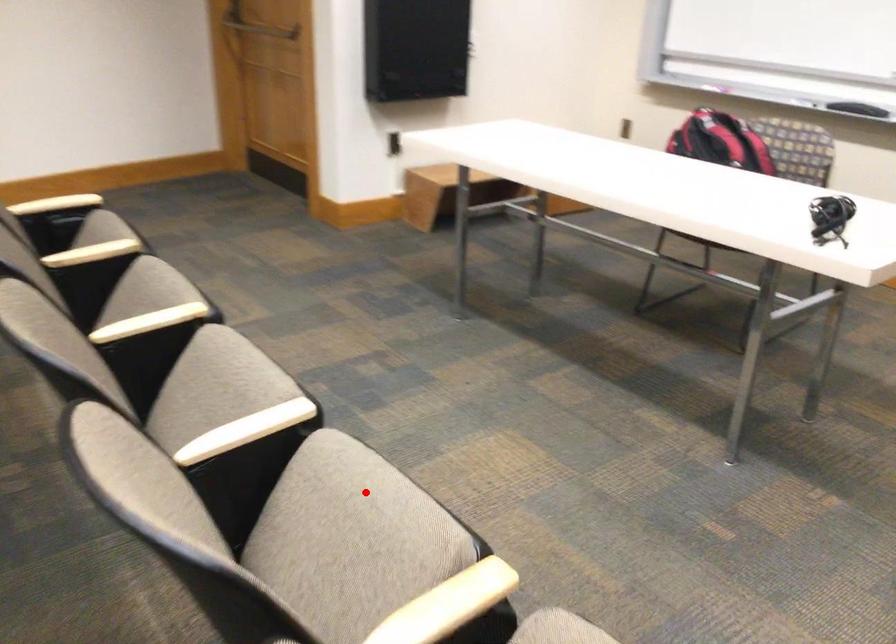
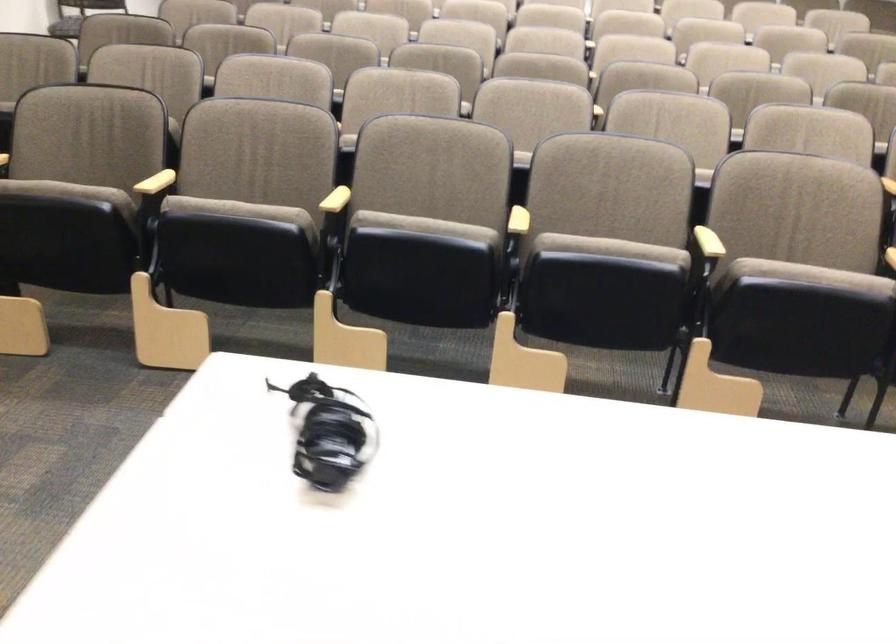
The point at the highlighted location is marked in the first image. Where is the corresponding point in the second image?

(424, 225)